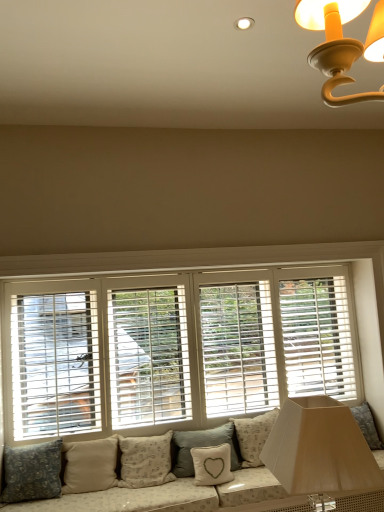
Question: Is the depth of beige fabric pillow at center, positioned as the 3th pillow in left-to-right order, greater than that of white fabric pillow with heart design at lower center, which appears as the second pillow when viewed from the right?

Choices:
 (A) yes
 (B) no

Answer: (B)

Question: Is beige fabric pillow at center, which ranks as the fourth pillow in right-to-left order, positioned with its back to white fabric pillow with heart design at lower center, which appears as the second pillow when viewed from the right?

Choices:
 (A) yes
 (B) no

Answer: (B)

Question: Is the position of beige fabric pillow at center, which ranks as the fourth pillow in right-to-left order, less distant than that of white fabric pillow with heart design at lower center, the 5th pillow positioned from the left?

Choices:
 (A) yes
 (B) no

Answer: (A)

Question: From a real-world perspective, is beige fabric pillow at center, which ranks as the fourth pillow in right-to-left order, beneath white fabric pillow with heart design at lower center, the 5th pillow positioned from the left?

Choices:
 (A) no
 (B) yes

Answer: (A)

Question: Can you confirm if beige fabric pillow at center, which ranks as the fourth pillow in right-to-left order, is taller than white fabric pillow with heart design at lower center, the 5th pillow positioned from the left?

Choices:
 (A) yes
 (B) no

Answer: (A)

Question: Is dark gray fabric pillow at lower left, acting as the sixth pillow starting from the right, in front of or behind white fabric pillow with heart design at lower center, which appears as the second pillow when viewed from the right, in the image?

Choices:
 (A) behind
 (B) front

Answer: (B)

Question: From the image's perspective, is dark gray fabric pillow at lower left, acting as the sixth pillow starting from the right, located above or below white fabric pillow with heart design at lower center, which appears as the second pillow when viewed from the right?

Choices:
 (A) above
 (B) below

Answer: (B)

Question: Considering the positions of point (26, 480) and point (218, 468), is point (26, 480) closer or farther from the camera than point (218, 468)?

Choices:
 (A) farther
 (B) closer

Answer: (B)

Question: From a real-world perspective, relative to white fabric pillow with heart design at lower center, which appears as the second pillow when viewed from the right, is dark gray fabric pillow at lower left, positioned as the 1th pillow in left-to-right order, vertically above or below?

Choices:
 (A) above
 (B) below

Answer: (A)

Question: In the image, is matte white lampshade at lower right positioned in front of or behind beige fabric pillow at center, positioned as the 3th pillow in left-to-right order?

Choices:
 (A) front
 (B) behind

Answer: (A)

Question: Does point (327, 490) appear closer or farther from the camera than point (148, 457)?

Choices:
 (A) closer
 (B) farther

Answer: (A)

Question: In the image, is matte white lampshade at lower right on the left side or the right side of beige fabric pillow at center, which ranks as the fourth pillow in right-to-left order?

Choices:
 (A) left
 (B) right

Answer: (B)

Question: Is matte white lampshade at lower right spatially inside beige fabric pillow at center, positioned as the 3th pillow in left-to-right order, or outside of it?

Choices:
 (A) outside
 (B) inside

Answer: (A)

Question: In the image, is beige fabric pillow at lower center, which is the 2th pillow in left-to-right order, on the left side or the right side of white fabric pillow with heart design at lower center, the 5th pillow positioned from the left?

Choices:
 (A) left
 (B) right

Answer: (A)

Question: Considering the positions of beige fabric pillow at lower center, marked as the 5th pillow in a right-to-left arrangement, and white fabric pillow with heart design at lower center, the 5th pillow positioned from the left, in the image, is beige fabric pillow at lower center, marked as the 5th pillow in a right-to-left arrangement, wider or thinner than white fabric pillow with heart design at lower center, the 5th pillow positioned from the left,?

Choices:
 (A) wide
 (B) thin

Answer: (A)